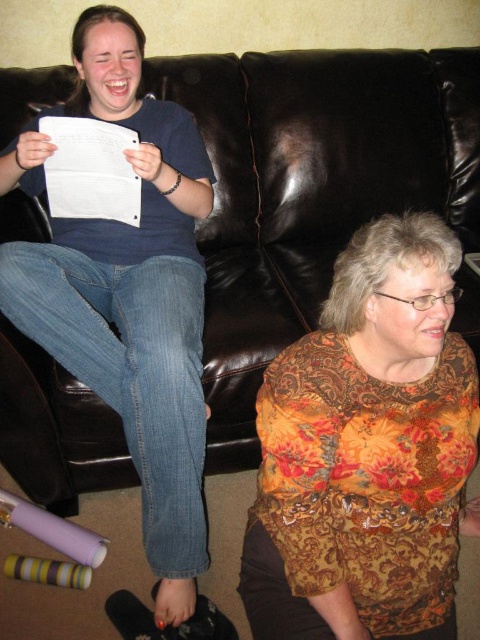
Based on the photo, you are planning to place a new decorative item on the brown leather couch at center and the white paper at upper left. Considering their sizes, which surface would be more suitable for a larger decorative item?

The brown leather couch at center has a larger size compared to the white paper at upper left, so it would be more suitable for placing a larger decorative item.